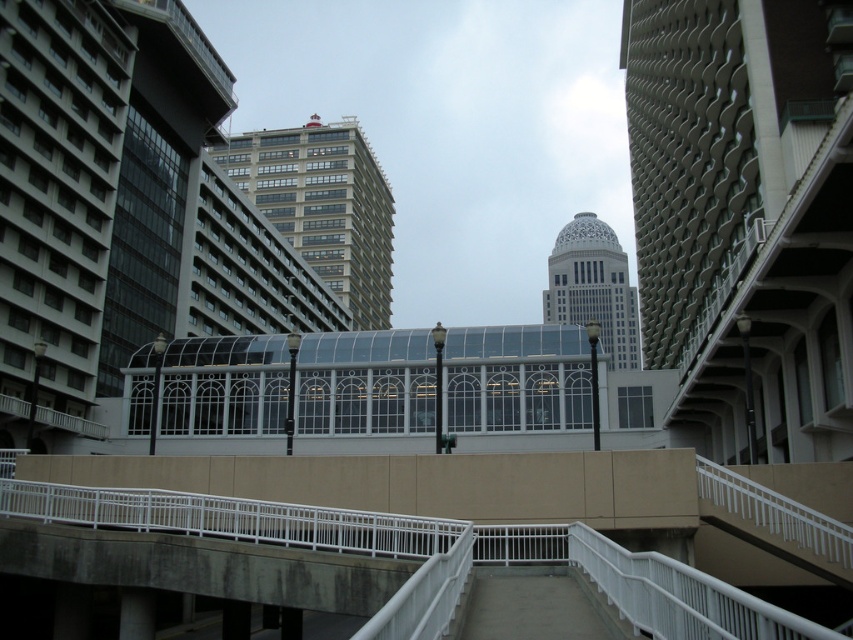
The height and width of the screenshot is (640, 853). Describe the element at coordinates (323, 205) in the screenshot. I see `beige glass building at center` at that location.

The height and width of the screenshot is (640, 853). Identify the location of beige glass building at center. (323, 205).